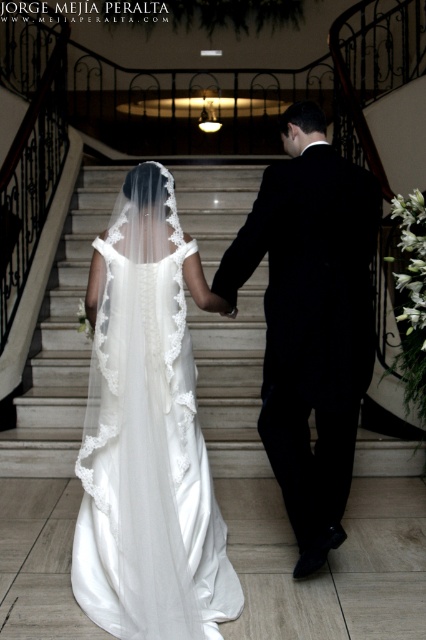
Does white satin dress at center appear under black satin suit at center?

Indeed, white satin dress at center is positioned under black satin suit at center.

Does white satin dress at center come behind black satin suit at center?

No, it is in front of black satin suit at center.

You are a GUI agent. You are given a task and a screenshot of the screen. Output one action in this format:
    pyautogui.click(x=<x>, y=<y>)
    Task: Click on the white satin dress at center
    The image size is (426, 640).
    Given the screenshot: What is the action you would take?
    pyautogui.click(x=147, y=433)

Can you confirm if black satin suit at center is smaller than white marble stairs at center?

Correct, black satin suit at center occupies less space than white marble stairs at center.

The image size is (426, 640). What do you see at coordinates (310, 321) in the screenshot?
I see `black satin suit at center` at bounding box center [310, 321].

Where is `black satin suit at center`? black satin suit at center is located at coordinates (310, 321).

Does white satin dress at center have a lesser width compared to white marble stairs at center?

In fact, white satin dress at center might be wider than white marble stairs at center.

Who is lower down, white satin dress at center or white marble stairs at center?

Positioned lower is white satin dress at center.

Is point (103, 522) behind point (106, 179)?

That is False.

The width and height of the screenshot is (426, 640). I want to click on white satin dress at center, so click(147, 433).